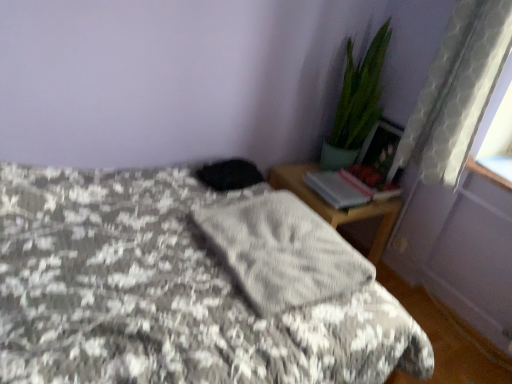
Question: Considering the relative positions of wooden nightstand at right and gray textured blanket at center in the image provided, is wooden nightstand at right to the right of gray textured blanket at center from the viewer's perspective?

Choices:
 (A) no
 (B) yes

Answer: (B)

Question: Is wooden nightstand at right further to camera compared to gray textured blanket at center?

Choices:
 (A) no
 (B) yes

Answer: (B)

Question: Is wooden nightstand at right outside of gray textured blanket at center?

Choices:
 (A) no
 (B) yes

Answer: (B)

Question: Is wooden nightstand at right bigger than gray textured blanket at center?

Choices:
 (A) yes
 (B) no

Answer: (B)

Question: Is wooden nightstand at right wider than gray textured blanket at center?

Choices:
 (A) no
 (B) yes

Answer: (A)

Question: Is gray textured blanket at center surrounded by wooden nightstand at right?

Choices:
 (A) no
 (B) yes

Answer: (A)

Question: Does clear glass window sill at upper right have a larger size compared to gray fabric at center?

Choices:
 (A) no
 (B) yes

Answer: (A)

Question: From a real-world perspective, is clear glass window sill at upper right physically above gray fabric at center?

Choices:
 (A) no
 (B) yes

Answer: (B)

Question: Is clear glass window sill at upper right to the left of gray fabric at center from the viewer's perspective?

Choices:
 (A) no
 (B) yes

Answer: (A)

Question: Considering the relative sizes of clear glass window sill at upper right and gray fabric at center in the image provided, is clear glass window sill at upper right smaller than gray fabric at center?

Choices:
 (A) no
 (B) yes

Answer: (B)

Question: Is clear glass window sill at upper right oriented away from gray fabric at center?

Choices:
 (A) yes
 (B) no

Answer: (B)

Question: Does clear glass window sill at upper right have a greater height compared to gray fabric at center?

Choices:
 (A) no
 (B) yes

Answer: (A)

Question: Considering the relative sizes of gray textured blanket at center and white sheer curtain at right in the image provided, is gray textured blanket at center smaller than white sheer curtain at right?

Choices:
 (A) yes
 (B) no

Answer: (B)